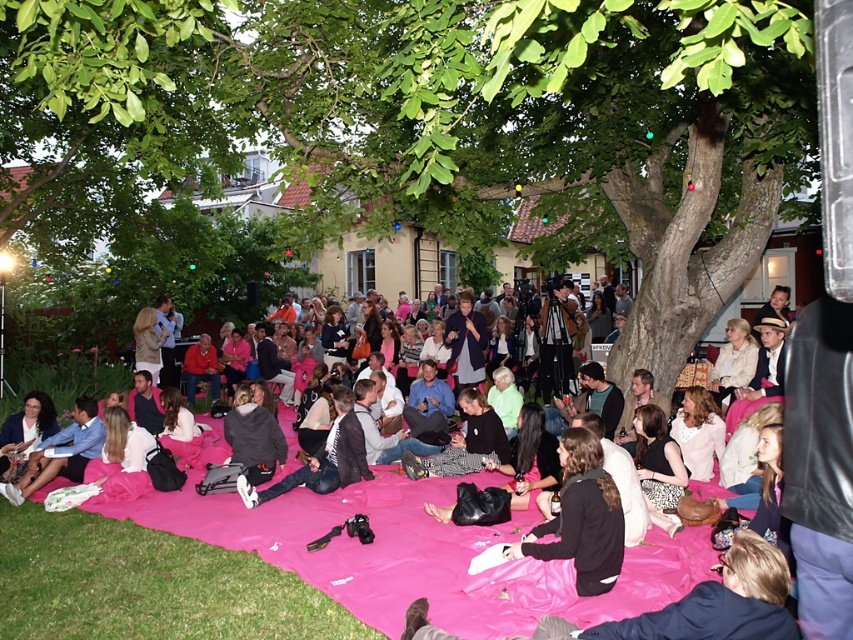
Does dark gray jacket at center appear under matte blue shirt at lower left?

Indeed, dark gray jacket at center is positioned under matte blue shirt at lower left.

Can you confirm if dark gray jacket at center is taller than matte blue shirt at lower left?

Yes.

Is point (357, 461) positioned behind point (27, 467)?

No.

Locate an element on the screen. dark gray jacket at center is located at coordinates (323, 458).

Between point (189, 35) and point (178, 577), which one is positioned behind?

Positioned behind is point (178, 577).

Which of these two, green leafy tree at upper center or pink fabric blanket at center, stands taller?

Standing taller between the two is green leafy tree at upper center.

What do you see at coordinates (444, 122) in the screenshot? The width and height of the screenshot is (853, 640). I see `green leafy tree at upper center` at bounding box center [444, 122].

Find the location of `green leafy tree at upper center`. green leafy tree at upper center is located at coordinates (444, 122).

Does pink fabric blanket at center come in front of matte blue shirt at lower left?

Yes, pink fabric blanket at center is in front of matte blue shirt at lower left.

From the picture: Is pink fabric blanket at center taller than matte blue shirt at lower left?

Incorrect, pink fabric blanket at center's height is not larger of matte blue shirt at lower left's.

The width and height of the screenshot is (853, 640). Find the location of `pink fabric blanket at center`. pink fabric blanket at center is located at coordinates (236, 566).

What are the coordinates of `pink fabric blanket at center` in the screenshot? It's located at (236, 566).